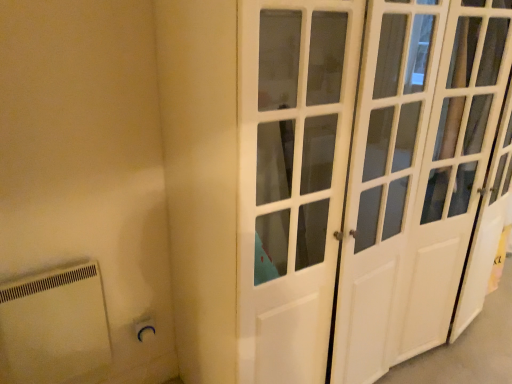
Question: Is white plastic radiator at lower left surrounded by white plastic electric outlet at lower left?

Choices:
 (A) yes
 (B) no

Answer: (B)

Question: From a real-world perspective, is white plastic electric outlet at lower left physically below white plastic radiator at lower left?

Choices:
 (A) yes
 (B) no

Answer: (A)

Question: Is white plastic electric outlet at lower left facing away from white plastic radiator at lower left?

Choices:
 (A) yes
 (B) no

Answer: (A)

Question: From the image's perspective, is white plastic electric outlet at lower left under white plastic radiator at lower left?

Choices:
 (A) yes
 (B) no

Answer: (B)

Question: Can you confirm if white plastic electric outlet at lower left is shorter than white plastic radiator at lower left?

Choices:
 (A) yes
 (B) no

Answer: (A)

Question: Is white plastic electric outlet at lower left to the right of white plastic radiator at lower left from the viewer's perspective?

Choices:
 (A) no
 (B) yes

Answer: (B)

Question: Does white glossy door at center have a smaller size compared to white plastic radiator at lower left?

Choices:
 (A) yes
 (B) no

Answer: (B)

Question: Is white glossy door at center beside white plastic radiator at lower left?

Choices:
 (A) no
 (B) yes

Answer: (A)

Question: Is white glossy door at center at the right side of white plastic radiator at lower left?

Choices:
 (A) yes
 (B) no

Answer: (A)

Question: From the image's perspective, is white glossy door at center located above white plastic radiator at lower left?

Choices:
 (A) no
 (B) yes

Answer: (B)

Question: Does white glossy door at center appear on the left side of white plastic radiator at lower left?

Choices:
 (A) yes
 (B) no

Answer: (B)

Question: From a real-world perspective, is white glossy door at center positioned under white plastic radiator at lower left based on gravity?

Choices:
 (A) yes
 (B) no

Answer: (B)

Question: Can you confirm if white plastic electric outlet at lower left is smaller than white glossy door at center?

Choices:
 (A) yes
 (B) no

Answer: (A)